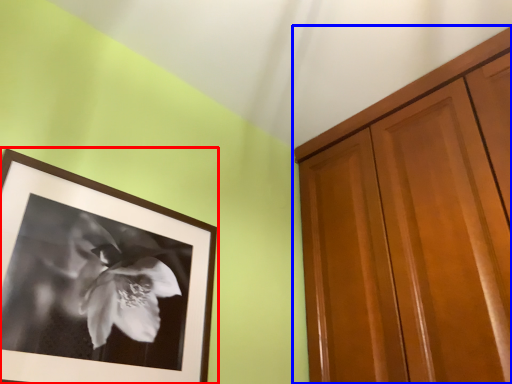
Question: Among these objects, which one is nearest to the camera, picture frame (highlighted by a red box) or cabinetry (highlighted by a blue box)?

Choices:
 (A) picture frame
 (B) cabinetry

Answer: (A)